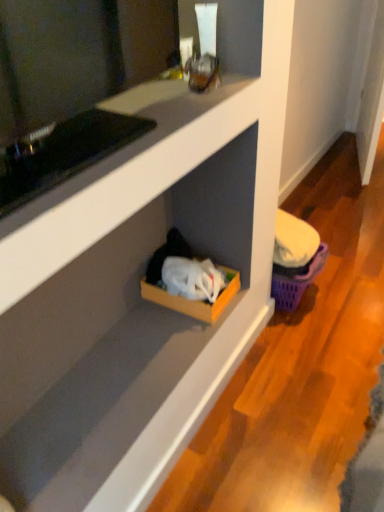
Question: Could you tell me if purple plastic basket at lower right is facing wooden cardboard box at lower center?

Choices:
 (A) no
 (B) yes

Answer: (A)

Question: From a real-world perspective, is purple plastic basket at lower right under wooden cardboard box at lower center?

Choices:
 (A) yes
 (B) no

Answer: (A)

Question: From the image's perspective, would you say purple plastic basket at lower right is shown under wooden cardboard box at lower center?

Choices:
 (A) no
 (B) yes

Answer: (A)

Question: Would you consider purple plastic basket at lower right to be distant from wooden cardboard box at lower center?

Choices:
 (A) no
 (B) yes

Answer: (A)

Question: Does purple plastic basket at lower right appear on the left side of wooden cardboard box at lower center?

Choices:
 (A) no
 (B) yes

Answer: (A)

Question: Is purple plastic basket at lower right beside wooden cardboard box at lower center?

Choices:
 (A) yes
 (B) no

Answer: (B)

Question: Is wooden cardboard box at lower center far from purple plastic basket at lower right?

Choices:
 (A) yes
 (B) no

Answer: (B)

Question: Considering the relative positions of wooden cardboard box at lower center and purple plastic basket at lower right in the image provided, is wooden cardboard box at lower center in front of purple plastic basket at lower right?

Choices:
 (A) no
 (B) yes

Answer: (B)

Question: Does wooden cardboard box at lower center turn towards purple plastic basket at lower right?

Choices:
 (A) yes
 (B) no

Answer: (B)

Question: Considering the relative sizes of wooden cardboard box at lower center and purple plastic basket at lower right in the image provided, is wooden cardboard box at lower center thinner than purple plastic basket at lower right?

Choices:
 (A) yes
 (B) no

Answer: (B)

Question: From a real-world perspective, is wooden cardboard box at lower center located higher than purple plastic basket at lower right?

Choices:
 (A) no
 (B) yes

Answer: (B)

Question: From the image's perspective, does wooden cardboard box at lower center appear higher than purple plastic basket at lower right?

Choices:
 (A) no
 (B) yes

Answer: (A)

Question: From a real-world perspective, is purple plastic basket at lower right physically located above or below wooden cardboard box at lower center?

Choices:
 (A) above
 (B) below

Answer: (B)